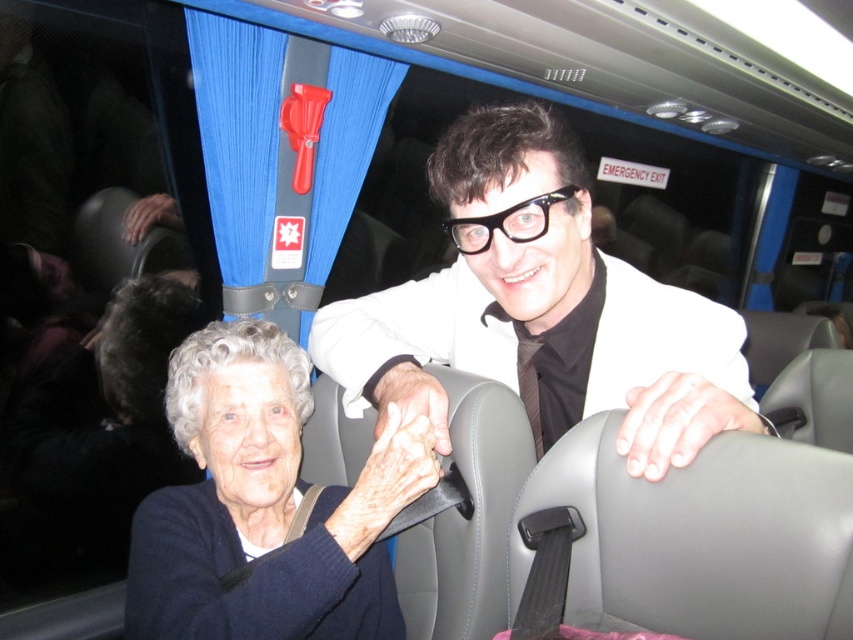
Question: Is white glossy suit at center thinner than dark blue sweater at lower left?

Choices:
 (A) yes
 (B) no

Answer: (B)

Question: Does white glossy suit at center appear on the left side of dark blue sweater at lower left?

Choices:
 (A) no
 (B) yes

Answer: (A)

Question: Which point is closer to the camera?

Choices:
 (A) (169, 579)
 (B) (386, 349)

Answer: (A)

Question: Does white glossy suit at center come in front of dark blue sweater at lower left?

Choices:
 (A) no
 (B) yes

Answer: (B)

Question: Which object appears farthest from the camera in this image?

Choices:
 (A) white glossy suit at center
 (B) dark blue sweater at lower left

Answer: (B)